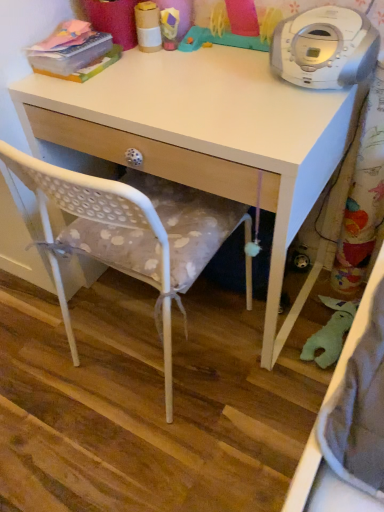
Image resolution: width=384 pixels, height=512 pixels. I want to click on free space in front of white matte desk at center, so pos(181,436).